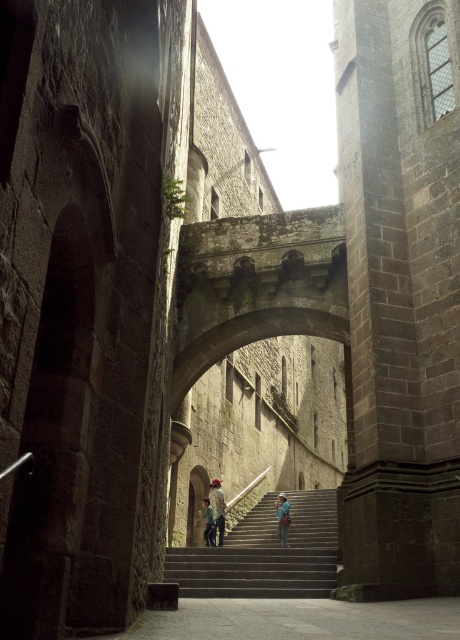
You are standing in the corridor and want to place a new decorative item exactly where the light blue denim jeans at center are located. What are the coordinates of that location?

The coordinates of the location where the light blue denim jeans at center are positioned is at point (218, 508).

You are standing in the historic stone corridor and want to move towards the stairs. You notice both the stone textured stairs at center and the blue denim jeans at center. Which object is positioned to the left of the other?

The stone textured stairs at center are to the left of blue denim jeans at center.

You are a tour guide leading a group through a medieval castle. You notice the stone textured stairs at center and the blue denim jeans at center. Which object takes up more space in the corridor?

The stone textured stairs at center is larger in size than the blue denim jeans at center, so the stone textured stairs at center takes up more space in the corridor.